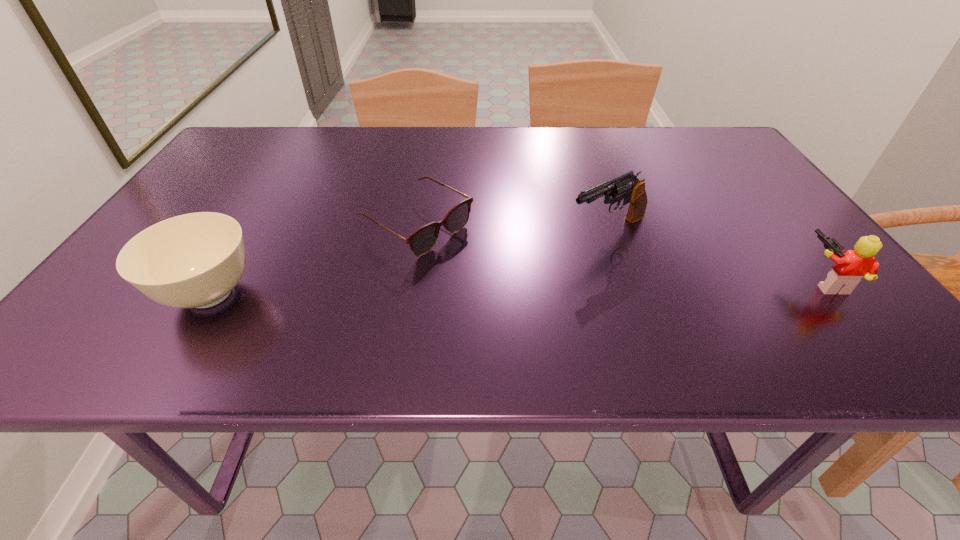
Where is `free space between the spectacles and the third object from left to right`? This screenshot has height=540, width=960. free space between the spectacles and the third object from left to right is located at coordinates (513, 229).

The image size is (960, 540). In order to click on vacant space that is in between the third object from left to right and the third object from right to left in this screenshot , I will do `click(513, 229)`.

Image resolution: width=960 pixels, height=540 pixels. Identify the location of free spot between the Lego and the second object from left to right. (621, 254).

Locate an element on the screen. This screenshot has width=960, height=540. unoccupied area between the shortest object and the Lego is located at coordinates (621, 254).

Locate an element on the screen. free space between the third object from left to right and the leftmost object is located at coordinates [409, 263].

Locate an element on the screen. The height and width of the screenshot is (540, 960). vacant region between the Lego and the second object from left to right is located at coordinates (621, 254).

Where is `empty space between the gun and the leftmost object`? The width and height of the screenshot is (960, 540). empty space between the gun and the leftmost object is located at coordinates (409, 263).

Image resolution: width=960 pixels, height=540 pixels. Find the location of `vacant space that's between the sugar bowl and the second object from left to right`. vacant space that's between the sugar bowl and the second object from left to right is located at coordinates (313, 260).

In order to click on object that stands as the closest to the leftmost object in this screenshot , I will do `click(421, 241)`.

Locate which object ranks in proximity to the sugar bowl. Please provide its 2D coordinates. Your answer should be formatted as a tuple, i.e. [(x, y)], where the tuple contains the x and y coordinates of a point satisfying the conditions above.

[(421, 241)]